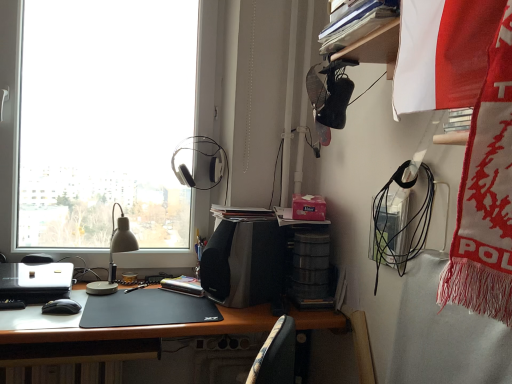
Question: From the image's perspective, is black matte mouse at lower left beneath hardcover book at center?

Choices:
 (A) yes
 (B) no

Answer: (A)

Question: Is black matte mouse at lower left oriented away from hardcover book at center?

Choices:
 (A) no
 (B) yes

Answer: (A)

Question: Considering the relative sizes of black matte mouse at lower left and hardcover book at center in the image provided, is black matte mouse at lower left thinner than hardcover book at center?

Choices:
 (A) no
 (B) yes

Answer: (B)

Question: Is black matte mouse at lower left closer to the viewer compared to hardcover book at center?

Choices:
 (A) yes
 (B) no

Answer: (A)

Question: Considering the relative positions of black matte mouse at lower left and hardcover book at center in the image provided, is black matte mouse at lower left behind hardcover book at center?

Choices:
 (A) yes
 (B) no

Answer: (B)

Question: Is black matte mouse at lower left not inside hardcover book at center?

Choices:
 (A) yes
 (B) no

Answer: (A)

Question: Does hardcover book at center turn towards black matte mouse at lower left?

Choices:
 (A) yes
 (B) no

Answer: (B)

Question: Is hardcover book at center completely or partially outside of black matte mouse at lower left?

Choices:
 (A) no
 (B) yes

Answer: (B)

Question: Is hardcover book at center taller than black matte mouse at lower left?

Choices:
 (A) yes
 (B) no

Answer: (B)

Question: Is hardcover book at center turned away from black matte mouse at lower left?

Choices:
 (A) no
 (B) yes

Answer: (A)

Question: From a real-world perspective, is hardcover book at center under black matte mouse at lower left?

Choices:
 (A) yes
 (B) no

Answer: (B)

Question: Does hardcover book at center contain black matte mouse at lower left?

Choices:
 (A) yes
 (B) no

Answer: (B)

Question: Is hardcover book at center taller than silver metallic laptop at left?

Choices:
 (A) yes
 (B) no

Answer: (A)